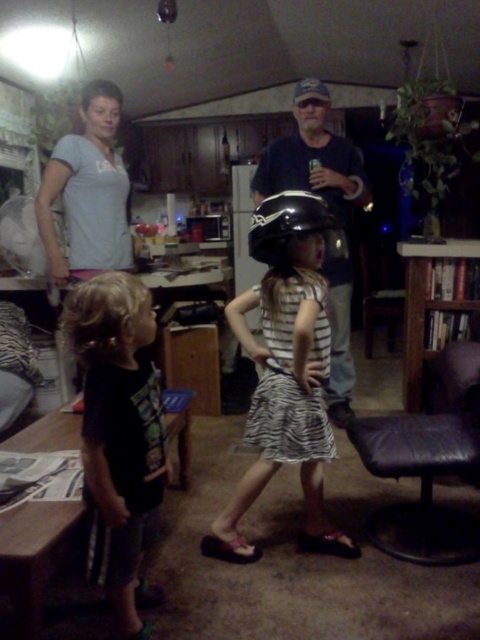
You are a parent trying to organize your childrens clothes. You have two shirts to place in a drawer. The black cotton shirt at left and the gray cotton shirt at upper left. The drawer is 1.5 meters long. Can both shirts fit side by side in the drawer?

The black cotton shirt at left is 1.31 meters from gray cotton shirt at upper left. Since the distance between them is 1.31 meters and the drawer is 1.5 meters long, both shirts can fit side by side in the drawer as the total required space is less than the drawer length.

You are a parent trying to dress your child properly. You have a dark blue denim shirt at center and a black matte helmet at center. According to the scene, which item should be placed on top of the other?

The dark blue denim shirt at center is below the black matte helmet at center, so the black matte helmet at center should be placed on top of the dark blue denim shirt at center.